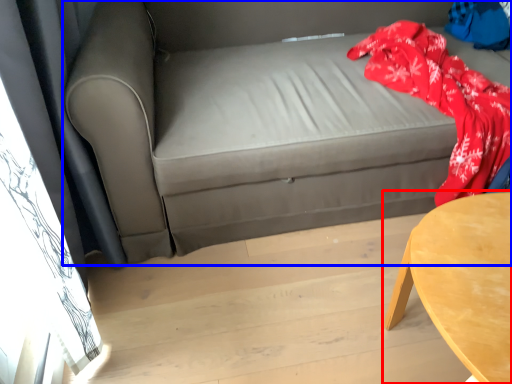
Question: Among these objects, which one is farthest to the camera, table (highlighted by a red box) or studio couch (highlighted by a blue box)?

Choices:
 (A) table
 (B) studio couch

Answer: (B)